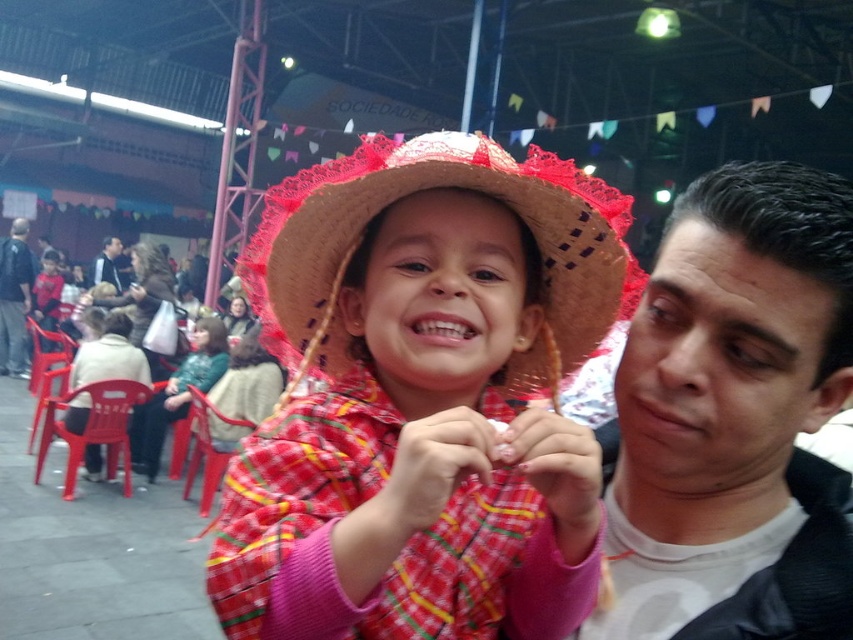
You are a photographer at the event and want to take a photo of the child wearing the straw hat at center. However, you notice the smooth black jacket at right might be blocking the view. Is the jacket in front of or behind the hat?

The smooth black jacket at right is positioned under the straw hat at center, so it is behind the hat and not blocking the view.

You are standing at the center of the image and want to find the dark blue jeans at left. In which direction should you look to see them?

You should look to the left to see the dark blue jeans at left since they are positioned at the left side of the image.